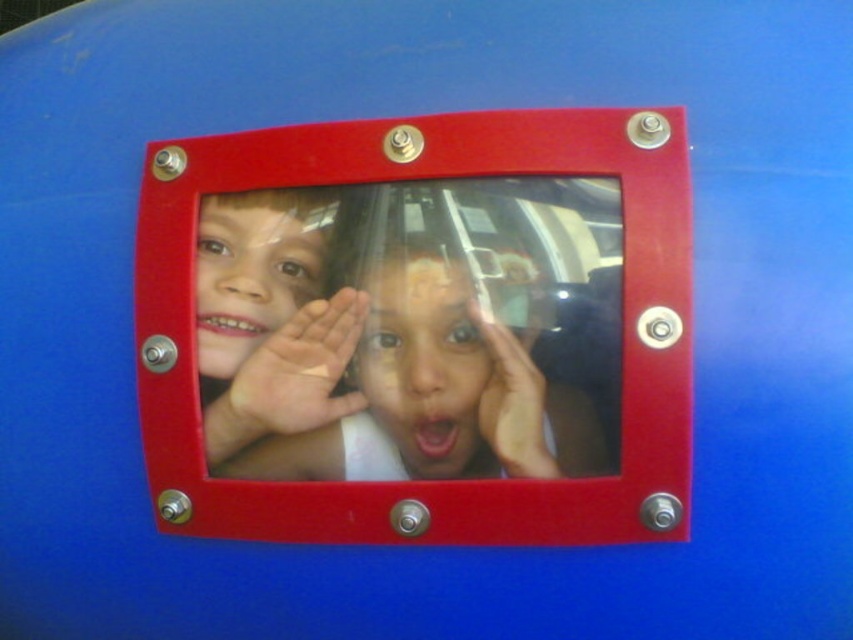
Between point (489, 337) and point (289, 195), which one is positioned in front?

Point (489, 337) is in front.

Does point (335, 458) come closer to viewer compared to point (326, 216)?

No, it is not.

Image resolution: width=853 pixels, height=640 pixels. I want to click on smooth skin child at center, so click(402, 387).

Who is more distant from viewer, (192, 177) or (418, 332)?

Positioned behind is point (192, 177).

Looking at this image, does matte plastic window at center appear on the left side of smooth skin face at center?

Indeed, matte plastic window at center is positioned on the left side of smooth skin face at center.

Which is behind, point (567, 132) or point (375, 378)?

Point (375, 378)

This screenshot has height=640, width=853. Find the location of `matte plastic window at center`. matte plastic window at center is located at coordinates (410, 179).

Is smooth skin child at center above smooth skin face at center?

Actually, smooth skin child at center is below smooth skin face at center.

How far apart are smooth skin child at center and smooth skin face at center?

smooth skin child at center and smooth skin face at center are 1.01 inches apart from each other.

Is point (401, 368) positioned after point (451, 474)?

No, (401, 368) is closer to viewer.

What are the coordinates of `smooth skin child at center` in the screenshot? It's located at (402, 387).